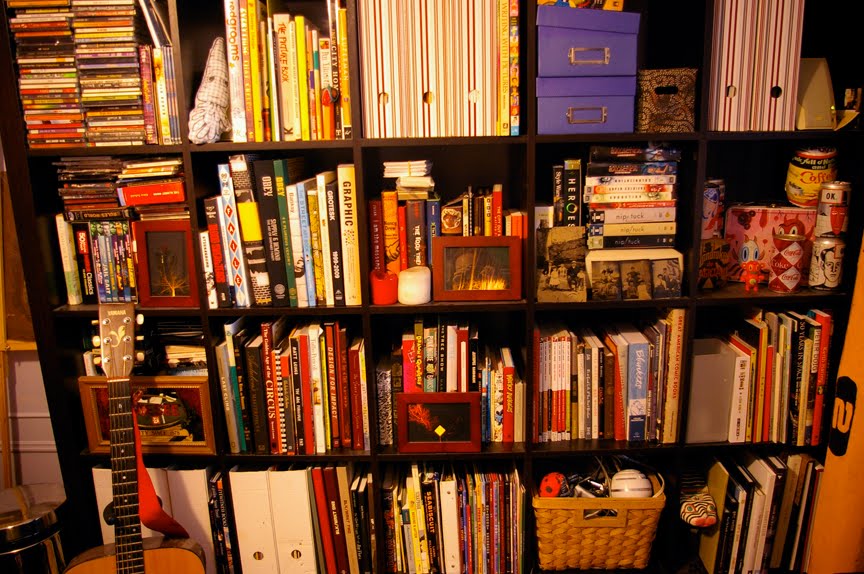
Where is `picture frames`? The image size is (864, 574). picture frames is located at coordinates (407, 443), (439, 395), (490, 296), (175, 304), (200, 387).